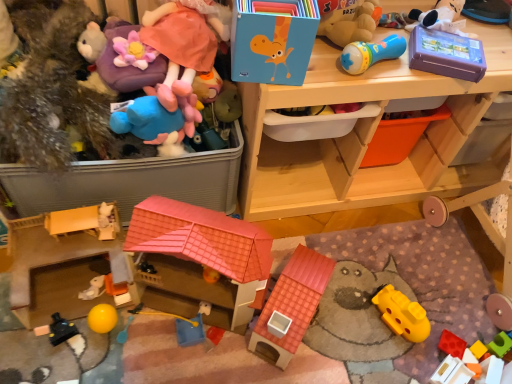
The width and height of the screenshot is (512, 384). I want to click on free space to the back side of rubberized plastic blocks at lower right, placed as the fourteenth toy when sorted from left to right, so click(458, 298).